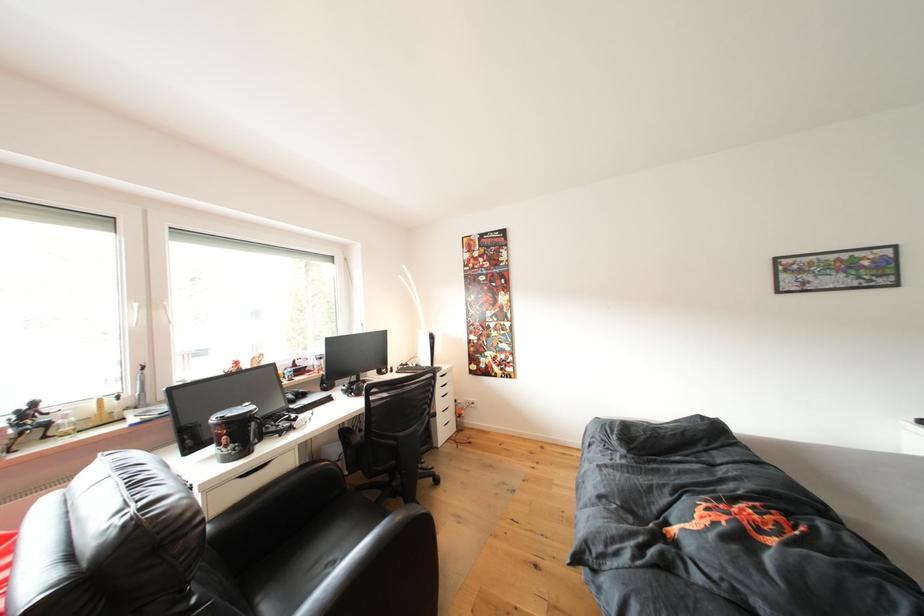
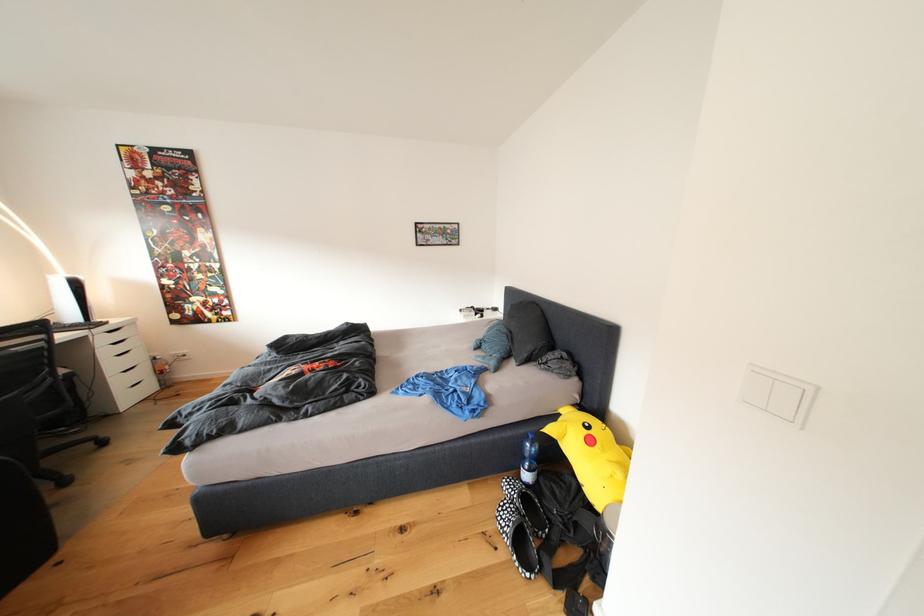
Where in the second image is the point corresponding to [459,419] from the first image?

(152, 379)